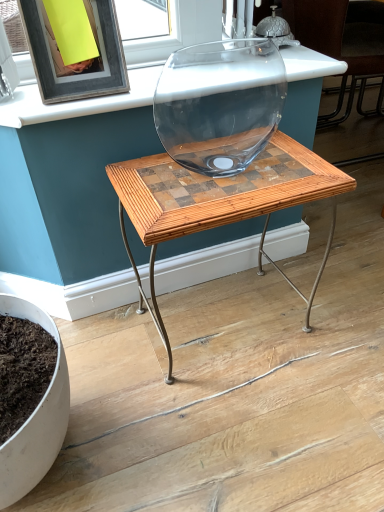
Question: Does transparent glass vase at center come in front of matte black frame at upper left?

Choices:
 (A) yes
 (B) no

Answer: (B)

Question: Does transparent glass vase at center appear on the left side of matte black frame at upper left?

Choices:
 (A) no
 (B) yes

Answer: (A)

Question: Can you confirm if transparent glass vase at center is wider than matte black frame at upper left?

Choices:
 (A) yes
 (B) no

Answer: (A)

Question: Is transparent glass vase at center bigger than matte black frame at upper left?

Choices:
 (A) yes
 (B) no

Answer: (A)

Question: Is transparent glass vase at center further to the viewer compared to matte black frame at upper left?

Choices:
 (A) yes
 (B) no

Answer: (A)

Question: Considering the relative sizes of transparent glass vase at center and matte black frame at upper left in the image provided, is transparent glass vase at center taller than matte black frame at upper left?

Choices:
 (A) no
 (B) yes

Answer: (B)

Question: Can you confirm if matte black frame at upper left is shorter than wooden mosaic table at center?

Choices:
 (A) no
 (B) yes

Answer: (B)

Question: Could you tell me if matte black frame at upper left is facing wooden mosaic table at center?

Choices:
 (A) yes
 (B) no

Answer: (B)

Question: Is matte black frame at upper left closer to camera compared to wooden mosaic table at center?

Choices:
 (A) yes
 (B) no

Answer: (B)

Question: Is matte black frame at upper left with wooden mosaic table at center?

Choices:
 (A) no
 (B) yes

Answer: (A)

Question: Is matte black frame at upper left positioned far away from wooden mosaic table at center?

Choices:
 (A) no
 (B) yes

Answer: (A)

Question: From the image's perspective, would you say matte black frame at upper left is positioned over wooden mosaic table at center?

Choices:
 (A) yes
 (B) no

Answer: (A)

Question: Is transparent glass vase at center to the left of wooden mosaic table at center from the viewer's perspective?

Choices:
 (A) yes
 (B) no

Answer: (B)